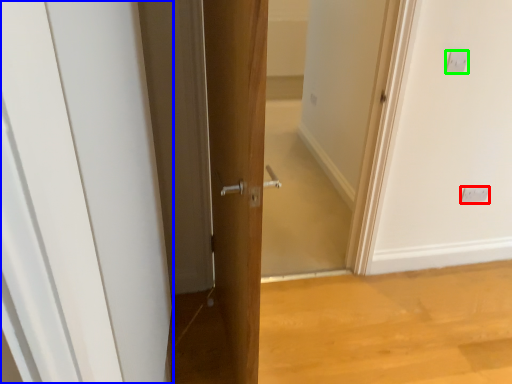
Question: Which is nearer to the electric outlet (highlighted by a red box)? door (highlighted by a blue box) or electric outlet (highlighted by a green box).

Choices:
 (A) door
 (B) electric outlet

Answer: (B)